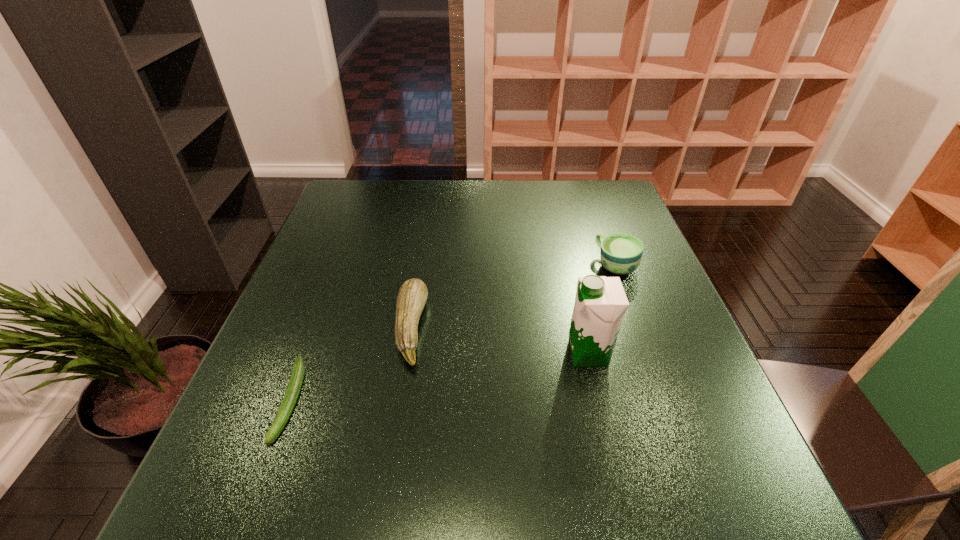
At what (x,y) coordinates should I click in order to perform the action: click on soya milk. Please return your answer as a coordinate pair (x, y). Looking at the image, I should click on (600, 304).

Identify the location of the third object from left to right. Image resolution: width=960 pixels, height=540 pixels. (600, 304).

Where is `cup`? The height and width of the screenshot is (540, 960). cup is located at coordinates (620, 253).

Where is `the rightmost object`? the rightmost object is located at coordinates (620, 253).

The width and height of the screenshot is (960, 540). I want to click on the third object from right to left, so click(412, 296).

Where is `the taller zucchini`? The width and height of the screenshot is (960, 540). the taller zucchini is located at coordinates (412, 296).

The width and height of the screenshot is (960, 540). In order to click on the shortest object in this screenshot , I will do `click(294, 386)`.

This screenshot has height=540, width=960. Find the location of `the left zucchini`. the left zucchini is located at coordinates (294, 386).

Where is `blank space located on the front-facing side of the soya milk`? The height and width of the screenshot is (540, 960). blank space located on the front-facing side of the soya milk is located at coordinates (486, 354).

I want to click on free region located 0.050m on the front-facing side of the soya milk, so click(542, 354).